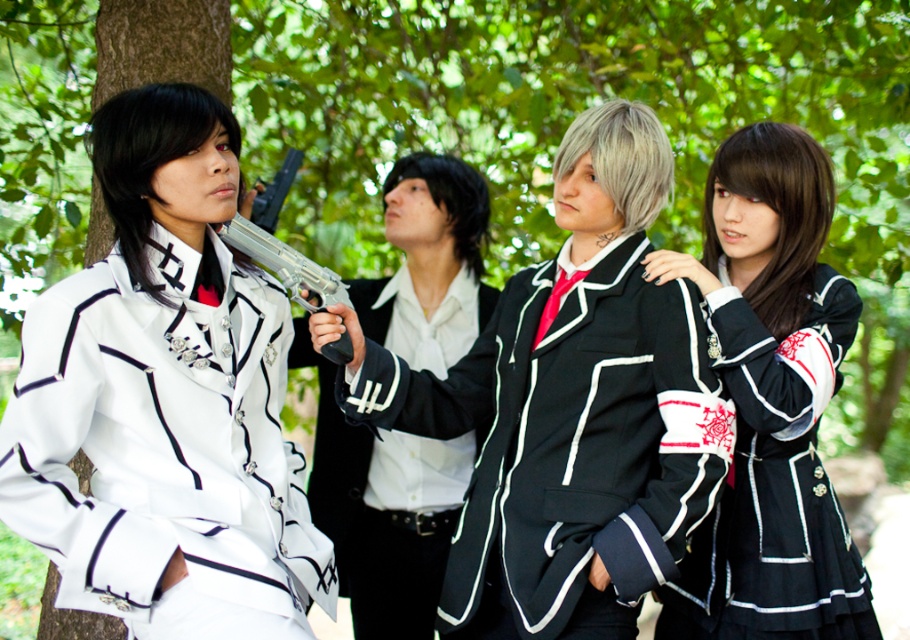
Does white glossy shirt at center have a lesser width compared to silver metallic revolver at center?

No.

You are a GUI agent. You are given a task and a screenshot of the screen. Output one action in this format:
    pyautogui.click(x=<x>, y=<y>)
    Task: Click on the white glossy shirt at center
    This screenshot has height=640, width=910.
    Given the screenshot: What is the action you would take?
    pyautogui.click(x=383, y=509)

Is black satin blazer at center shorter than white glossy shirt at center?

In fact, black satin blazer at center may be taller than white glossy shirt at center.

The height and width of the screenshot is (640, 910). Find the location of `black satin blazer at center`. black satin blazer at center is located at coordinates (569, 436).

You are a GUI agent. You are given a task and a screenshot of the screen. Output one action in this format:
    pyautogui.click(x=<x>, y=<y>)
    Task: Click on the black satin blazer at center
    The width and height of the screenshot is (910, 640).
    Given the screenshot: What is the action you would take?
    pyautogui.click(x=569, y=436)

Is white glossy uniform at left above black satin blazer at center?

Indeed, white glossy uniform at left is positioned over black satin blazer at center.

Who is lower down, white glossy uniform at left or black satin blazer at center?

black satin blazer at center is lower down.

Does point (125, 522) come farther from viewer compared to point (562, 621)?

No.

Locate an element on the screen. white glossy uniform at left is located at coordinates (164, 397).